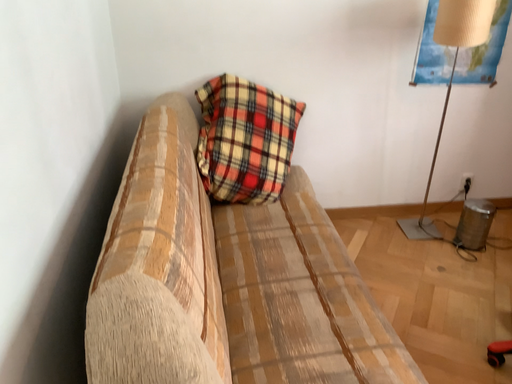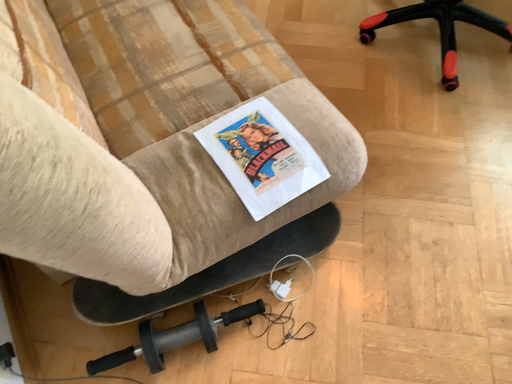
Question: Which way did the camera rotate in the video?

Choices:
 (A) rotated downward
 (B) rotated upward

Answer: (A)